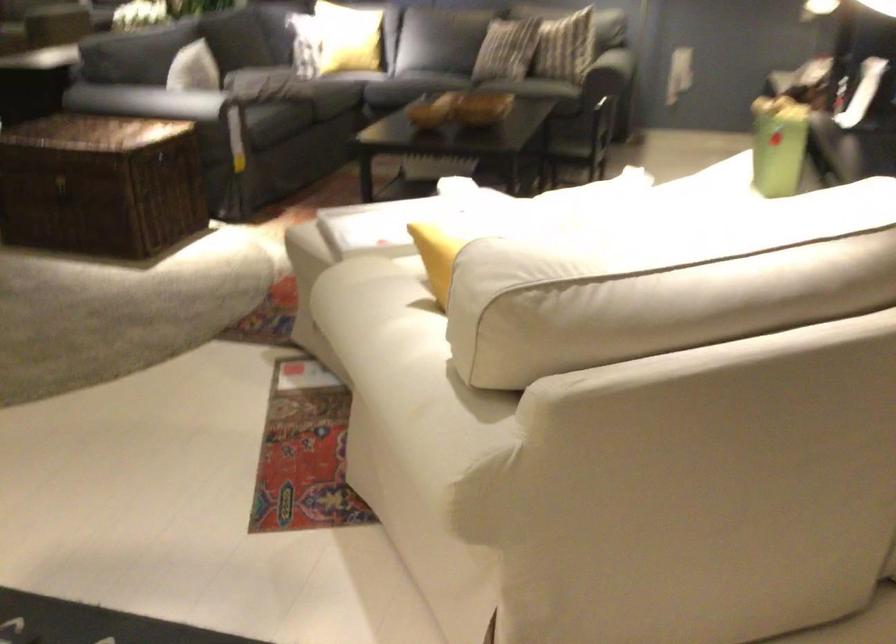
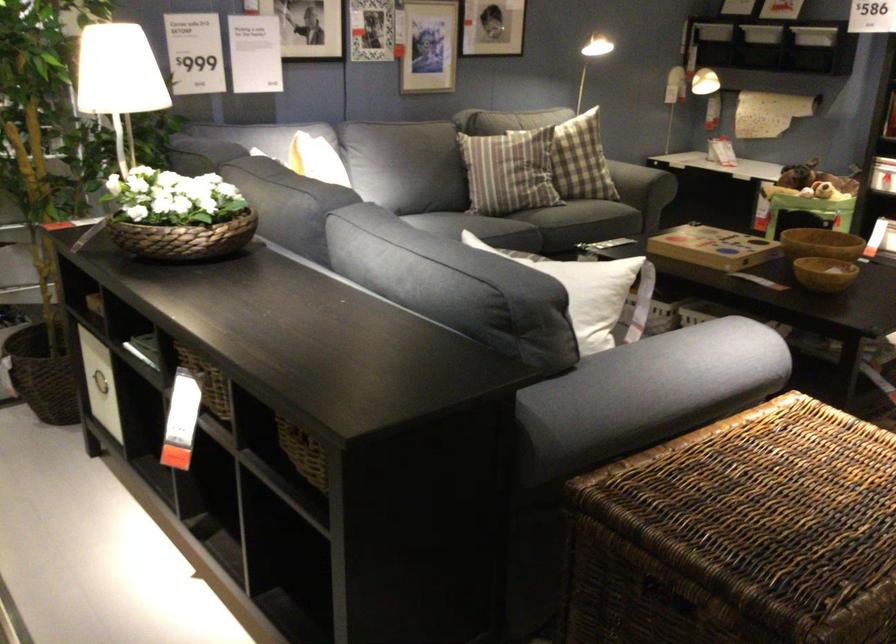
The point at (135,106) is marked in the first image. Where is the corresponding point in the second image?

(647, 393)